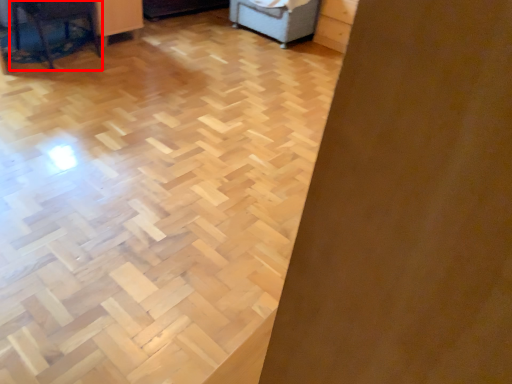
Question: From the image, what is the correct spatial relationship of furniture (annotated by the red box) in relation to furniture?

Choices:
 (A) left
 (B) right

Answer: (A)